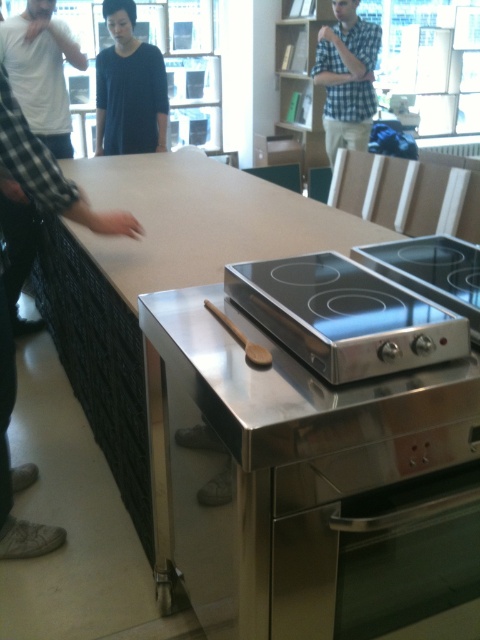
You are standing in the kitchen and notice two items at the upper center of the image. Which one is closer to you, the checkered fabric shirt at upper center or the wooden bookshelf at upper center?

The checkered fabric shirt at upper center is closer to you because it is in front of the wooden bookshelf at upper center.

You are a photographer setting up a shoot in this kitchen. You need to decide which object, the checkered fabric shirt at upper center or the wooden bookshelf at upper center, would block the light coming through the large windows more if placed in front of them. Based on their widths, which one should you avoid placing in front of the windows?

The checkered fabric shirt at upper center might be wider than the wooden bookshelf at upper center, so placing it in front of the windows could block more light. To minimize light obstruction, avoid placing the checkered fabric shirt at upper center in front of the windows.

You are a chef preparing to cook. You notice a dark blue shirt at upper center and a stainless steel cooktop at center in the kitchen. Which item takes up more space in the scene?

The dark blue shirt at upper center has a larger size compared to the stainless steel cooktop at center, so it takes up more space in the scene.